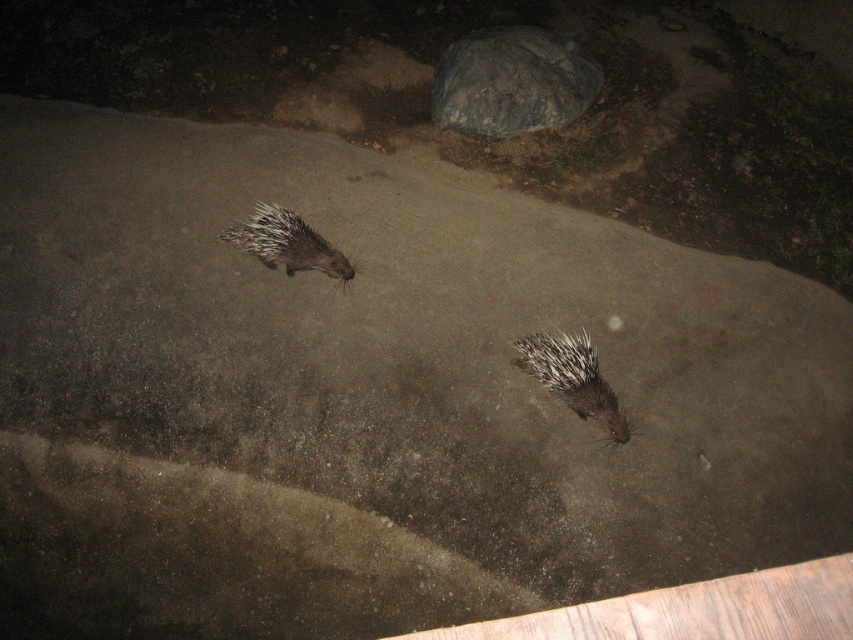
Which of these two, gray rough rock at upper center or spiky brown hedgehog at lower center, stands taller?

Standing taller between the two is gray rough rock at upper center.

Is gray rough rock at upper center below spiky brown hedgehog at lower center?

No, gray rough rock at upper center is not below spiky brown hedgehog at lower center.

Is point (494, 51) positioned behind point (581, 365)?

Yes, point (494, 51) is farther from viewer.

The width and height of the screenshot is (853, 640). Find the location of `gray rough rock at upper center`. gray rough rock at upper center is located at coordinates (512, 81).

Looking at this image, is gray rough rock at upper center above brown spiny hedgehog at center?

Yes, gray rough rock at upper center is above brown spiny hedgehog at center.

Image resolution: width=853 pixels, height=640 pixels. What do you see at coordinates (512, 81) in the screenshot? I see `gray rough rock at upper center` at bounding box center [512, 81].

Between point (463, 109) and point (285, 225), which one is positioned in front?

Point (285, 225) is more forward.

Image resolution: width=853 pixels, height=640 pixels. Identify the location of gray rough rock at upper center. (512, 81).

Is spiky brown hedgehog at lower center bigger than brown spiny hedgehog at center?

No.

This screenshot has width=853, height=640. Find the location of `spiky brown hedgehog at lower center`. spiky brown hedgehog at lower center is located at coordinates (572, 378).

The image size is (853, 640). Describe the element at coordinates (572, 378) in the screenshot. I see `spiky brown hedgehog at lower center` at that location.

Where is `spiky brown hedgehog at lower center`? The height and width of the screenshot is (640, 853). spiky brown hedgehog at lower center is located at coordinates (x=572, y=378).